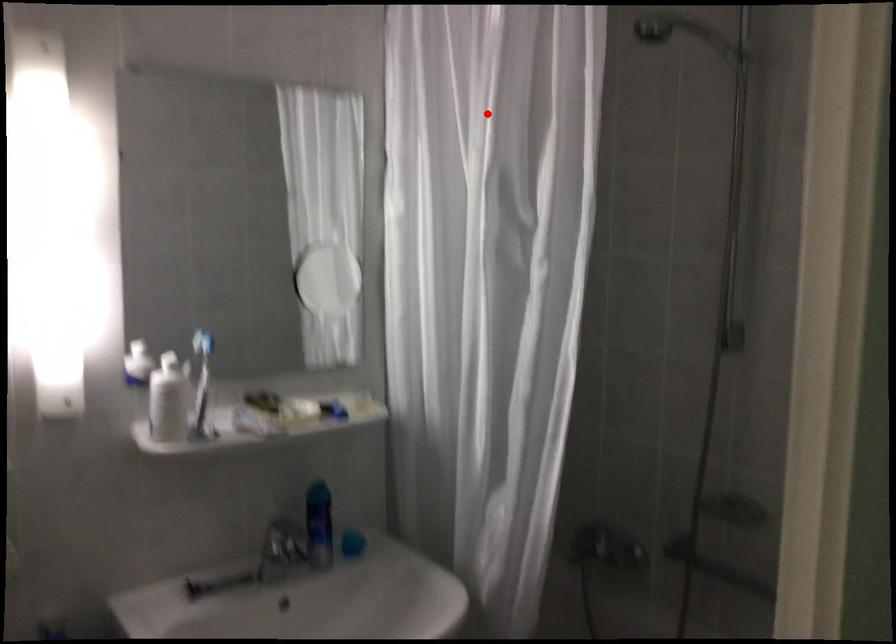
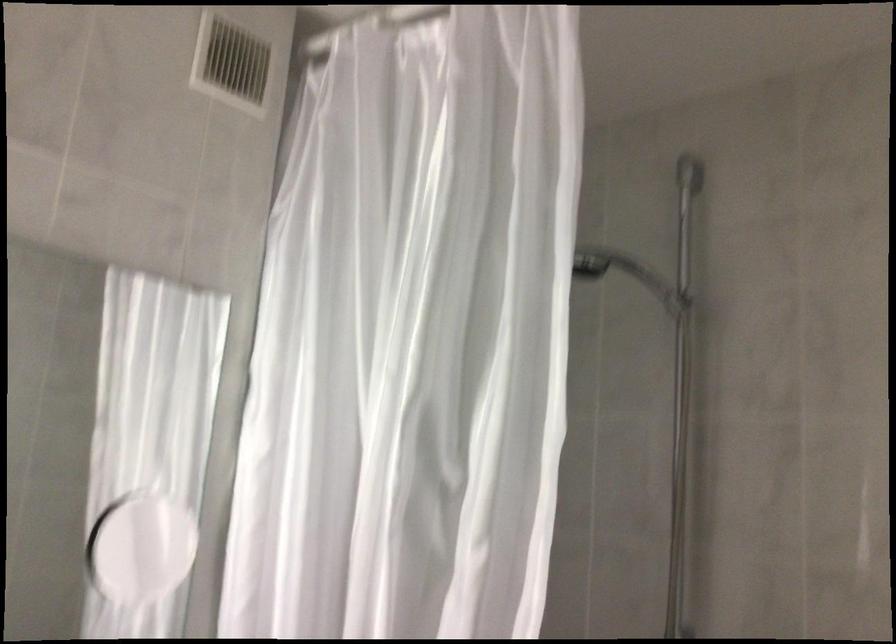
Question: I am providing you with two images of the same scene from different viewpoints. In image1, a red point is highlighted. Considering the same 3D point in image2, which of the following is correct?

Choices:
 (A) It is closer
 (B) It is farther

Answer: (A)